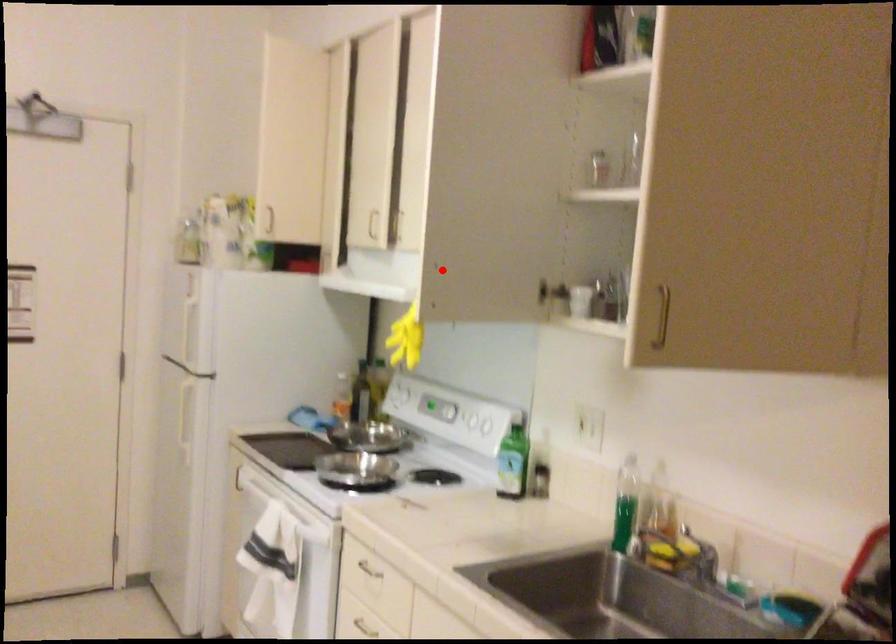
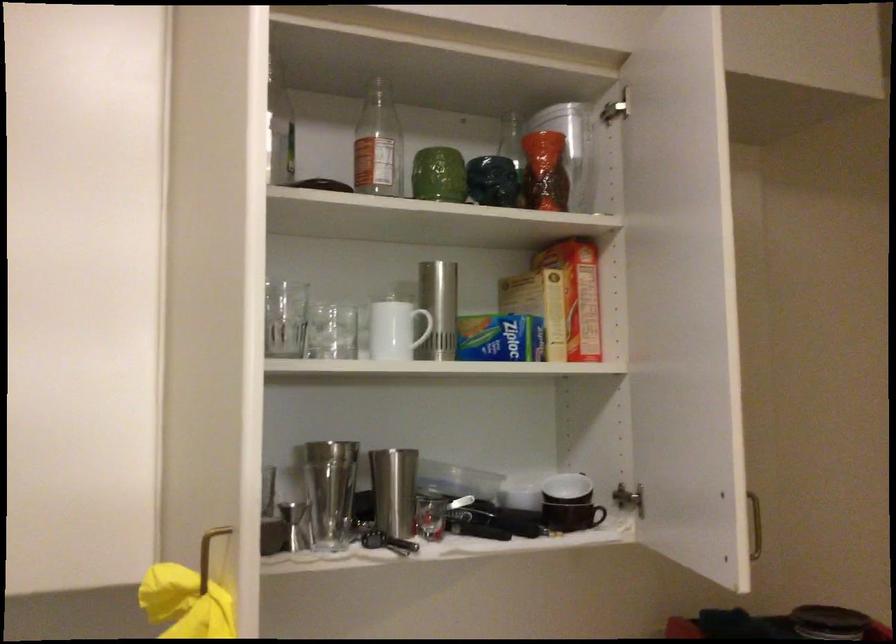
Question: I am providing you with two images of the same scene from different viewpoints. Image1 has a red point marked. In image2, the corresponding 3D location appears at what relative position? Reply with the corresponding letter.

Choices:
 (A) Closer
 (B) Farther

Answer: (A)